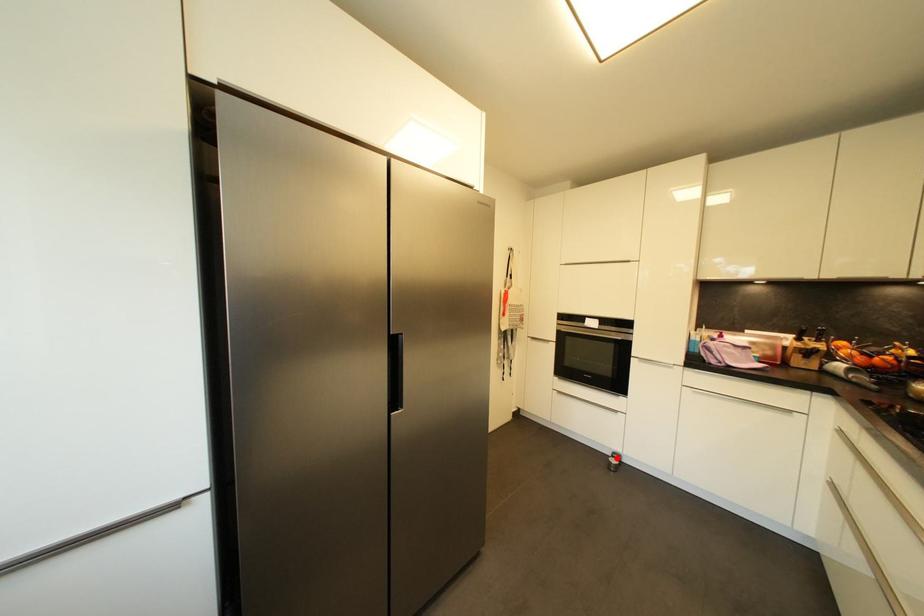
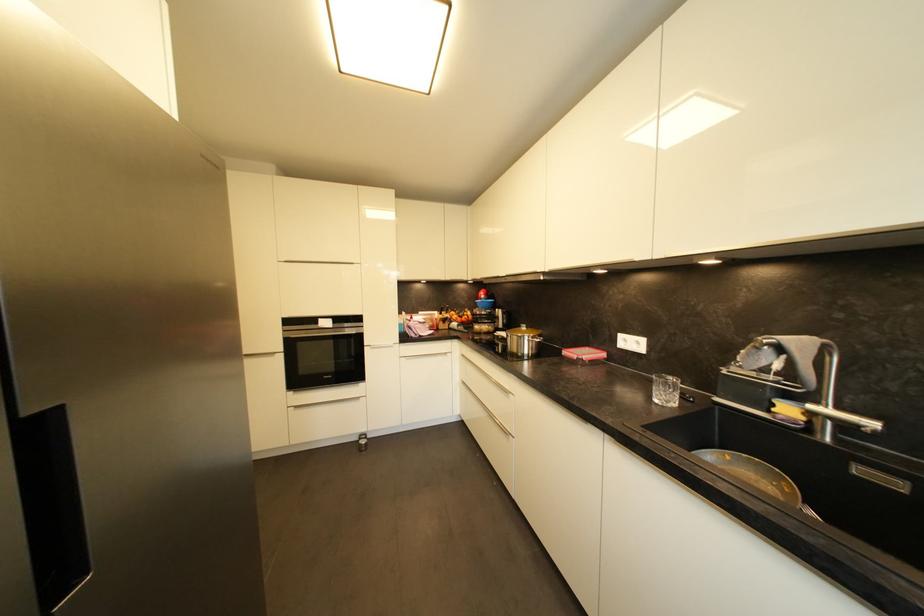
Question: I am providing you with two images of the same scene from different viewpoints. Image1 has a red point marked. In image2, the corresponding 3D location appears at what relative position? Reply with the corresponding letter.

Choices:
 (A) Closer
 (B) Farther

Answer: (A)